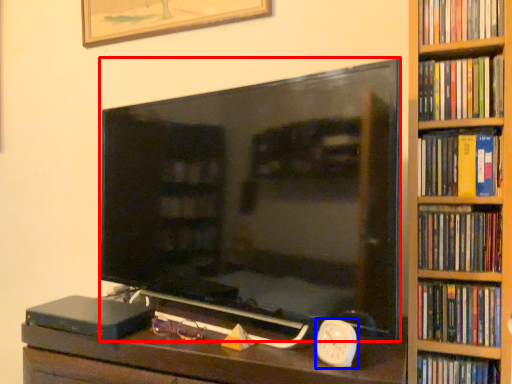
Question: Which object appears closest to the camera in this image, television (highlighted by a red box) or clock (highlighted by a blue box)?

Choices:
 (A) television
 (B) clock

Answer: (A)